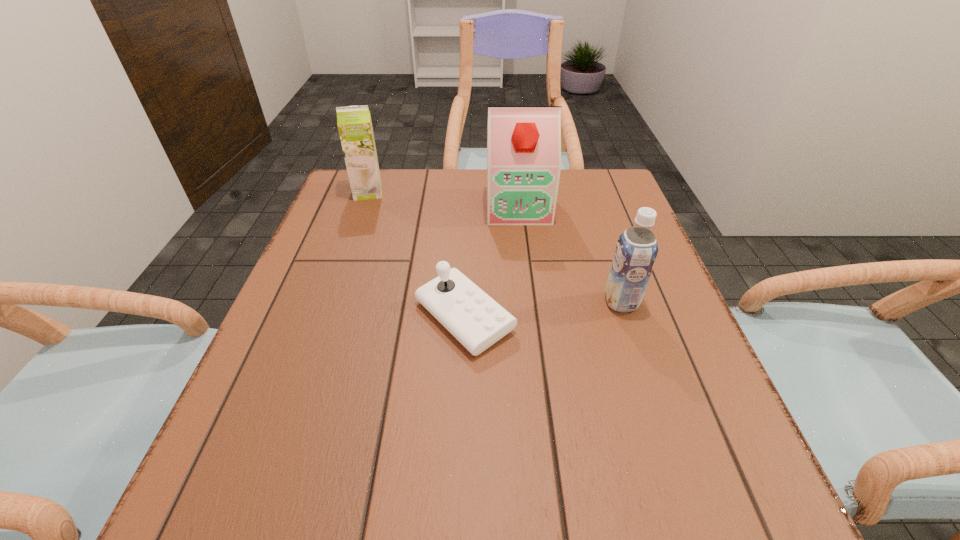
You are a GUI agent. You are given a task and a screenshot of the screen. Output one action in this format:
    pyautogui.click(x=<x>, y=<y>)
    Task: Click on the empty location between the rightmost object and the second soya milk from right to left
    The height and width of the screenshot is (540, 960).
    Given the screenshot: What is the action you would take?
    pyautogui.click(x=570, y=254)

I want to click on object identified as the third closest to the leftmost soya milk, so click(x=636, y=250).

Find the location of a particular element. The width and height of the screenshot is (960, 540). object that is the third closest to the rightmost soya milk is located at coordinates (354, 123).

This screenshot has width=960, height=540. In order to click on soya milk identified as the second closest to the second soya milk from left to right in this screenshot , I will do `click(354, 123)`.

This screenshot has width=960, height=540. In order to click on soya milk that is the nearest to the leftmost soya milk in this screenshot , I will do `click(523, 142)`.